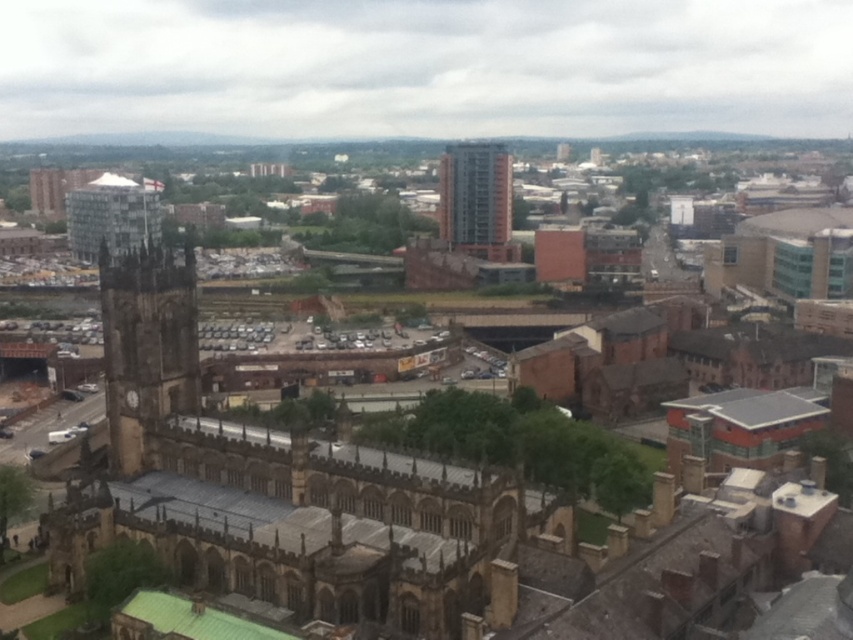
Question: Does orange brick building at center appear under matte glass tower at upper left?

Choices:
 (A) no
 (B) yes

Answer: (A)

Question: Among these points, which one is nearest to the camera?

Choices:
 (A) (136, 353)
 (B) (123, 188)

Answer: (A)

Question: Which point is closer to the camera?

Choices:
 (A) (198, 392)
 (B) (509, 225)
 (C) (71, 212)

Answer: (A)

Question: Is brown stone clock tower at left smaller than matte glass tower at upper left?

Choices:
 (A) no
 (B) yes

Answer: (B)

Question: Does brown stone clock tower at left come in front of matte glass tower at upper left?

Choices:
 (A) yes
 (B) no

Answer: (A)

Question: Which point is closer to the camera?

Choices:
 (A) (111, 340)
 (B) (70, 237)
 (C) (465, 154)

Answer: (A)